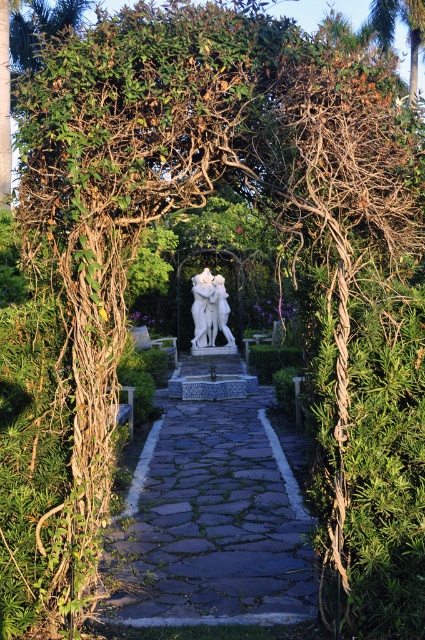
Question: Among these points, which one is nearest to the camera?

Choices:
 (A) (224, 296)
 (B) (303, 566)

Answer: (B)

Question: Does stone cobblestone path at center appear on the right side of white marble sculpture at center?

Choices:
 (A) yes
 (B) no

Answer: (A)

Question: Which point is closer to the camera taking this photo?

Choices:
 (A) (201, 276)
 (B) (210, 468)

Answer: (B)

Question: In this image, where is stone cobblestone path at center located relative to white marble sculpture at center?

Choices:
 (A) left
 (B) right

Answer: (B)

Question: Can you confirm if stone cobblestone path at center is positioned to the left of white marble sculpture at center?

Choices:
 (A) yes
 (B) no

Answer: (B)